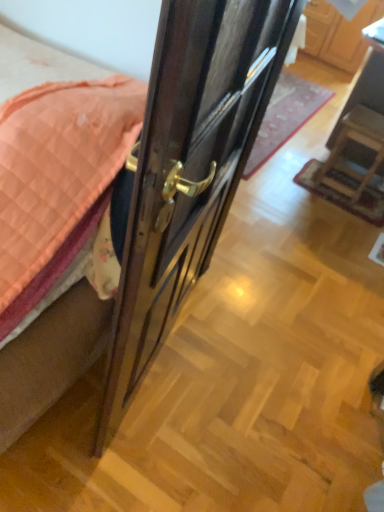
Question: Is glossy wood door at center closer to the viewer compared to polished brass door handle at center?

Choices:
 (A) no
 (B) yes

Answer: (B)

Question: From the image's perspective, does glossy wood door at center appear higher than polished brass door handle at center?

Choices:
 (A) no
 (B) yes

Answer: (A)

Question: Is glossy wood door at center wider than polished brass door handle at center?

Choices:
 (A) yes
 (B) no

Answer: (B)

Question: From the image's perspective, would you say glossy wood door at center is shown under polished brass door handle at center?

Choices:
 (A) yes
 (B) no

Answer: (A)

Question: Is glossy wood door at center located outside polished brass door handle at center?

Choices:
 (A) yes
 (B) no

Answer: (A)

Question: Considering the relative sizes of glossy wood door at center and polished brass door handle at center in the image provided, is glossy wood door at center bigger than polished brass door handle at center?

Choices:
 (A) no
 (B) yes

Answer: (B)

Question: Can you confirm if wooden chair at right is positioned to the left of wooden cabinet at upper center?

Choices:
 (A) yes
 (B) no

Answer: (A)

Question: Is wooden chair at right far from wooden cabinet at upper center?

Choices:
 (A) yes
 (B) no

Answer: (A)

Question: Does wooden chair at right have a lesser width compared to wooden cabinet at upper center?

Choices:
 (A) yes
 (B) no

Answer: (A)

Question: Is wooden chair at right surrounding wooden cabinet at upper center?

Choices:
 (A) no
 (B) yes

Answer: (A)

Question: Considering the relative sizes of wooden chair at right and wooden cabinet at upper center in the image provided, is wooden chair at right taller than wooden cabinet at upper center?

Choices:
 (A) no
 (B) yes

Answer: (B)

Question: Does wooden chair at right have a larger size compared to wooden cabinet at upper center?

Choices:
 (A) yes
 (B) no

Answer: (A)

Question: Is wooden cabinet at upper center positioned behind glossy wood door at center?

Choices:
 (A) no
 (B) yes

Answer: (B)